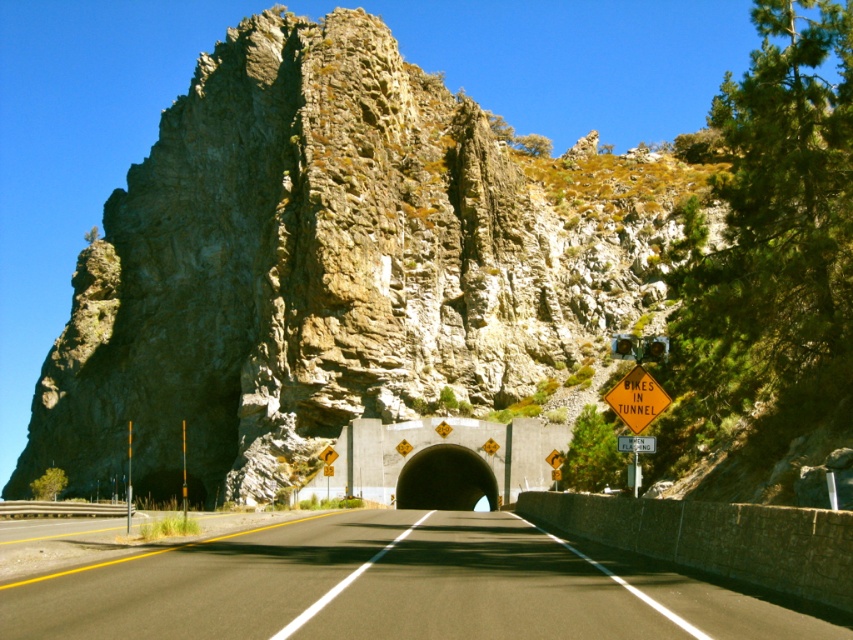
You are driving on the black asphalt road at center and need to make a sharp left turn ahead. However, there is a rocky cliff at center blocking your path. Can you safely make the turn without hitting the cliff?

The rocky cliff at center is positioned on the left side of the black asphalt road at center, so making a sharp left turn would bring you towards the cliff. Since the cliff is on the left side of the road, the turn might not be safe as there may not be enough space. Check the road markings or signs for guidance on safe turning distances.

You are a delivery driver approaching the tunnel entrance. You need to make a quick stop if you see the rocky cliff at center at a specific coordinate. What coordinate should you watch for to safely stop before the tunnel?

The rocky cliff at center is located at point (74,150), so you should watch for this coordinate to safely stop before the tunnel.

You are a driver approaching the tunnel entrance. You notice the black asphalt road at center and the yellow reflective diamond at center. Which object is positioned higher from the ground?

The yellow reflective diamond at center is higher from the ground since the black asphalt road at center is below it.